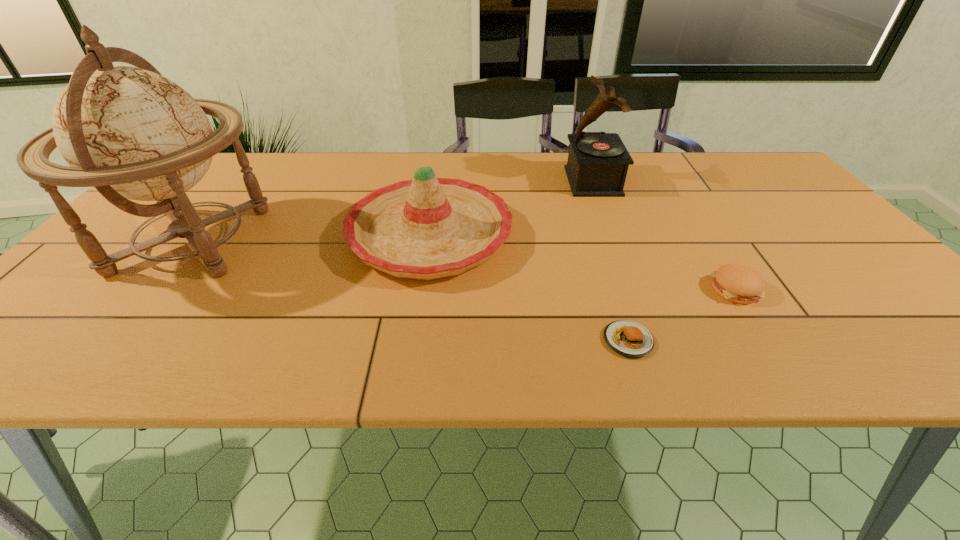
The width and height of the screenshot is (960, 540). I want to click on globe, so click(x=131, y=133).

Identify the location of the tallest object. (131, 133).

The image size is (960, 540). I want to click on phonograph_record, so click(597, 165).

I want to click on sombrero, so click(427, 228).

Where is `the third shortest object`? Image resolution: width=960 pixels, height=540 pixels. the third shortest object is located at coordinates (427, 228).

Identify the location of the fourth tallest object. The width and height of the screenshot is (960, 540). (737, 283).

At what (x,y) coordinates should I click in order to perform the action: click on the taller food. Please return your answer as a coordinate pair (x, y). Looking at the image, I should click on (737, 283).

Where is `the shorter food`? This screenshot has width=960, height=540. the shorter food is located at coordinates (627, 338).

The width and height of the screenshot is (960, 540). I want to click on the shortest object, so click(x=627, y=338).

Find the location of a particular element. This screenshot has height=540, width=960. vacant space located 0.190m at the front of the globe showing Africa is located at coordinates (351, 240).